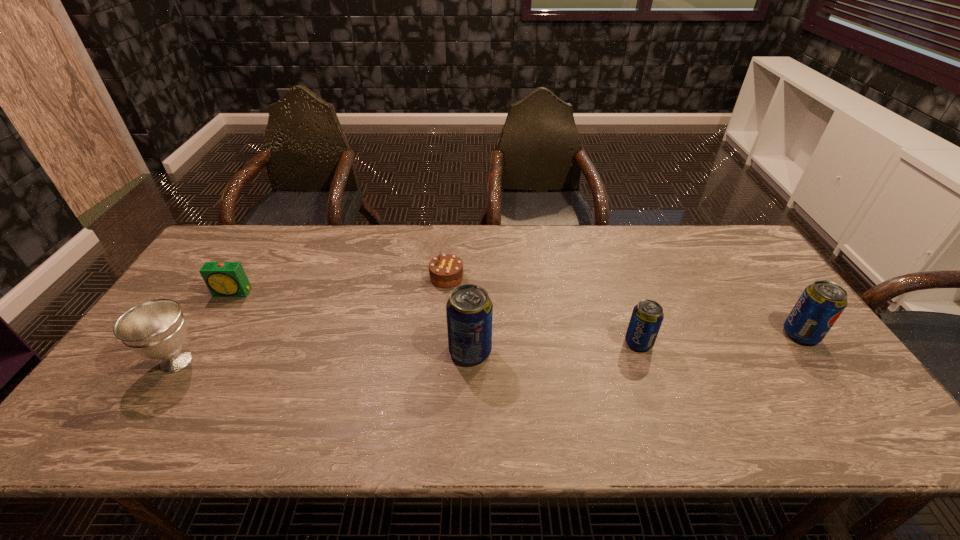
Find the location of a particular element. The height and width of the screenshot is (540, 960). free space located 0.070m on the left of the third shortest object is located at coordinates (598, 342).

Find the location of a particular element. Image resolution: width=960 pixels, height=540 pixels. free point located 0.080m on the back of the rightmost object is located at coordinates (777, 301).

I want to click on free space located 0.200m on the front-facing side of the alarm clock, so click(x=197, y=350).

Identify the location of free space located on the back of the chocolate cake. (450, 235).

I want to click on blank area located on the back of the chalice, so click(x=246, y=255).

This screenshot has width=960, height=540. In order to click on object that is at the far edge in this screenshot , I will do `click(446, 271)`.

The height and width of the screenshot is (540, 960). What are the coordinates of `object at the near edge` in the screenshot? It's located at (156, 329).

Locate an element on the screen. alarm clock that is at the left edge is located at coordinates (224, 279).

The width and height of the screenshot is (960, 540). I want to click on chalice that is at the left edge, so click(156, 329).

The width and height of the screenshot is (960, 540). I want to click on object that is at the right edge, so click(821, 303).